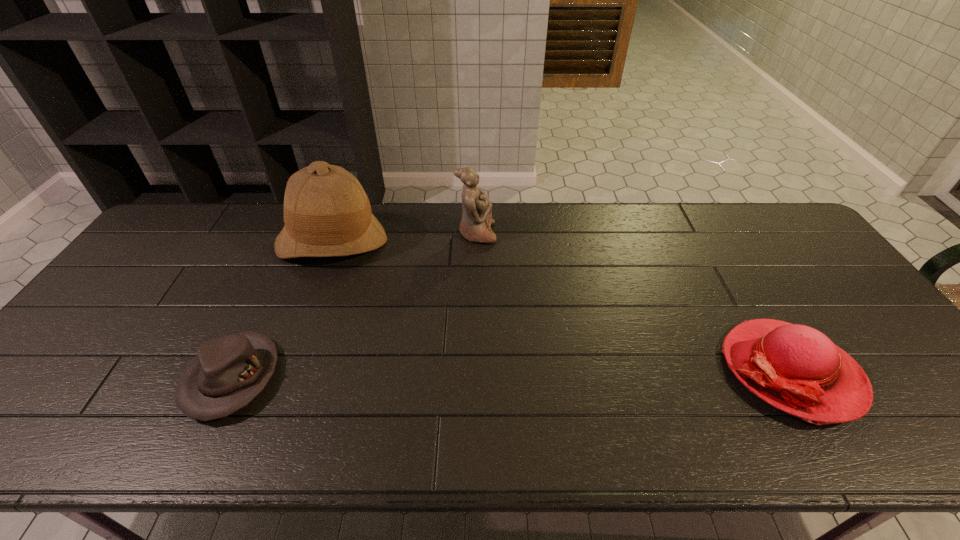
This screenshot has width=960, height=540. What are the coordinates of `vacant region at the far right corner` in the screenshot? It's located at (763, 221).

At what (x,y) coordinates should I click in order to perform the action: click on free space between the figurine and the farthest hat. Please return your answer as a coordinate pair (x, y). The width and height of the screenshot is (960, 540). Looking at the image, I should click on (404, 238).

In order to click on free space between the shortest object and the third shortest object in this screenshot , I will do `click(354, 306)`.

Find the location of a particular element. The height and width of the screenshot is (540, 960). free space that is in between the farthest hat and the rightmost object is located at coordinates (562, 306).

The height and width of the screenshot is (540, 960). Find the location of `free space between the rightmost object and the shortest object`. free space between the rightmost object and the shortest object is located at coordinates (512, 374).

Locate an element on the screen. vacant point located between the farthest hat and the rightmost hat is located at coordinates (562, 306).

In order to click on vacant space in between the tallest hat and the shortest hat in this screenshot , I will do `click(282, 309)`.

Find the location of a particular element. The width and height of the screenshot is (960, 540). free space between the third object from left to right and the rightmost object is located at coordinates (634, 302).

Find the location of `vacant area between the tallest hat and the shortest hat`. vacant area between the tallest hat and the shortest hat is located at coordinates (282, 309).

The height and width of the screenshot is (540, 960). What are the coordinates of `free space that is in between the second shortest object and the third shortest object` in the screenshot? It's located at (x=634, y=302).